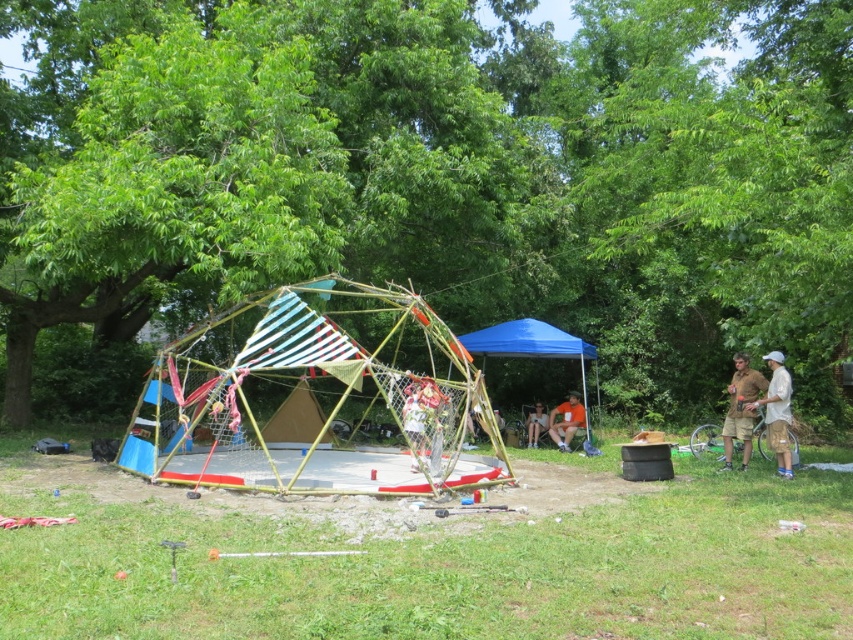
You are a photographer standing at the center of the geodesic dome. You want to take a photo of the brown fabric shorts at right and the white cotton shirt at right so that both appear in the frame. If your camera has a minimum focus distance of 20 inches, will both items be in focus?

The brown fabric shorts at right and white cotton shirt at right are 20.52 inches apart. Since the distance between them is greater than the camera minimum focus distance of 20 inches, both items will be in focus.

You are standing in the park and want to take a photo of the wooden frame tent at center and the floral fabric dress at center. Which object should you focus on first to ensure both are in the frame?

You should focus on the wooden frame tent at center first because it is closer to you than the floral fabric dress at center, so adjusting the camera to include it will also capture the dress in the background.